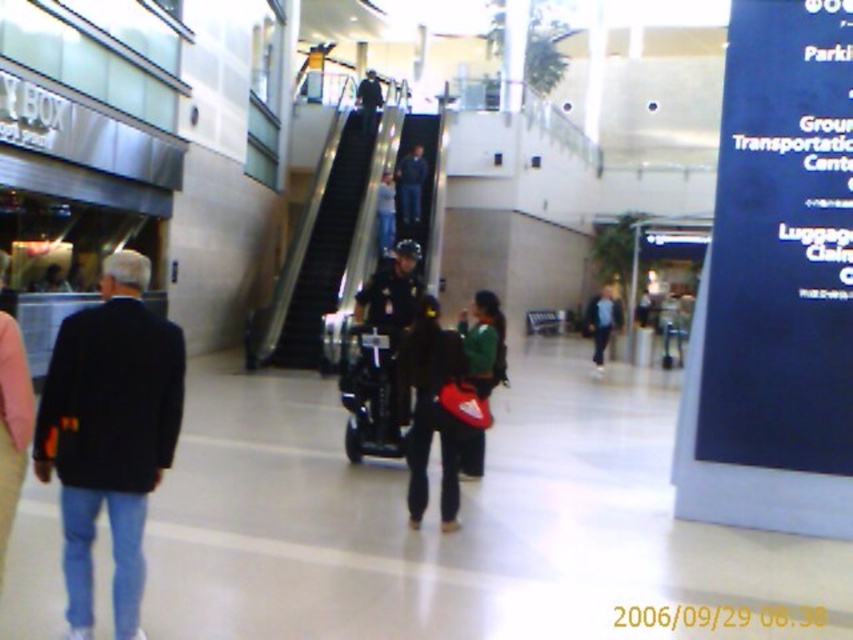
Is black matte jacket at left in front of dark blue uniform at center?

Yes, it is in front of dark blue uniform at center.

The image size is (853, 640). What do you see at coordinates (109, 433) in the screenshot?
I see `black matte jacket at left` at bounding box center [109, 433].

Find the location of a particular element. The height and width of the screenshot is (640, 853). black matte jacket at left is located at coordinates (109, 433).

Can you confirm if dark blue uniform at center is smaller than dark blue jeans at center?

No.

Who is more distant from viewer, (415, 260) or (412, 186)?

The point (412, 186) is more distant.

Between point (413, 298) and point (402, 193), which one is positioned in front?

Point (413, 298)

The width and height of the screenshot is (853, 640). Find the location of `dark blue uniform at center`. dark blue uniform at center is located at coordinates (390, 292).

Between black matte jacket at left and green matte jacket at center, which one appears on the left side from the viewer's perspective?

From the viewer's perspective, black matte jacket at left appears more on the left side.

Between point (33, 461) and point (497, 308), which one is positioned behind?

The point (497, 308) is behind.

Find the location of a particular element. The width and height of the screenshot is (853, 640). black matte jacket at left is located at coordinates (109, 433).